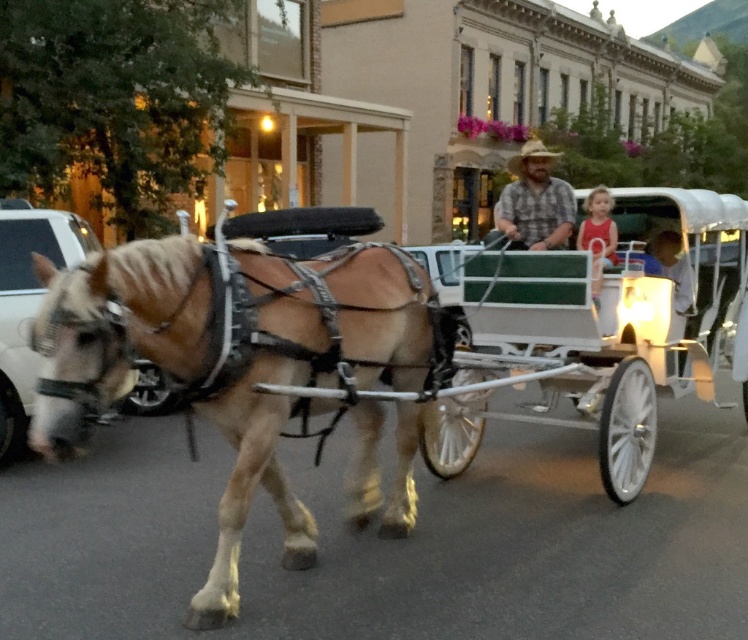
You are standing at the center of the image and want to move towards the point marked at coordinates (227, 356). Which direction should you go?

The point at coordinates (227, 356) corresponds to the light brown leather horse at left, so you should move towards the left direction.

You are standing in the town square and see the light brown leather horse at left and the matte red shirt at center. Which object is closer to you?

The light brown leather horse at left is closer to you because it is in front of the matte red shirt at center.